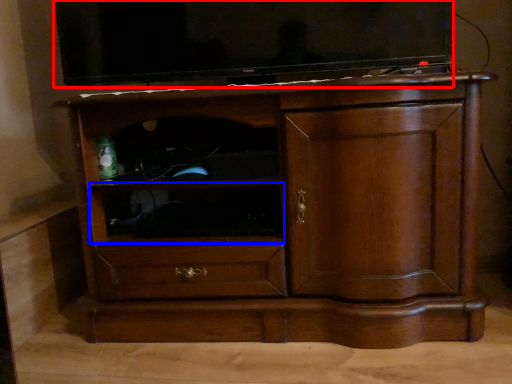
Question: Which of the following is the closest to the observer, television (highlighted by a red box) or shelf (highlighted by a blue box)?

Choices:
 (A) television
 (B) shelf

Answer: (A)